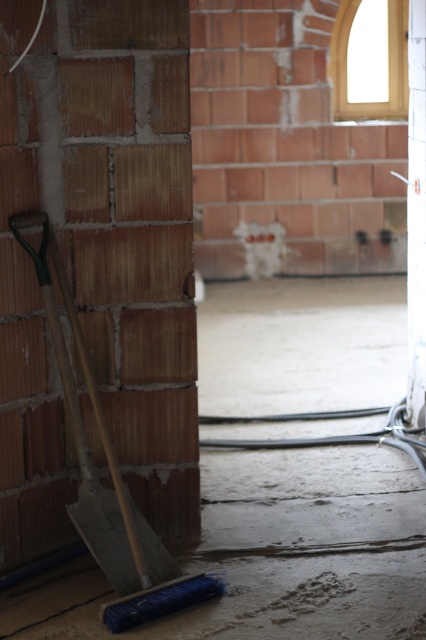
Does wooden shovel at left appear under white glossy pillar at center?

Indeed, wooden shovel at left is positioned under white glossy pillar at center.

This screenshot has height=640, width=426. Describe the element at coordinates (112, 480) in the screenshot. I see `wooden shovel at left` at that location.

Who is more distant from viewer, (104, 624) or (417, 38)?

Positioned behind is point (417, 38).

What are the coordinates of `wooden shovel at left` in the screenshot? It's located at (112, 480).

Is point (310, 358) more distant than point (138, 515)?

Yes, it is.

You are a GUI agent. You are given a task and a screenshot of the screen. Output one action in this format:
    pyautogui.click(x=<x>, y=<y>)
    Task: Click on the blue bristle broom at left
    This screenshot has height=640, width=426.
    Given the screenshot: What is the action you would take?
    pyautogui.click(x=273, y=554)

Who is more distant from viewer, (x=371, y=454) or (x=69, y=392)?

Positioned behind is point (x=371, y=454).

I want to click on blue bristle broom at left, so click(273, 554).

Can you confirm if blue bristle broom at left is taller than white glossy pillar at center?

In fact, blue bristle broom at left may be shorter than white glossy pillar at center.

Who is positioned more to the right, blue bristle broom at left or white glossy pillar at center?

white glossy pillar at center

Image resolution: width=426 pixels, height=640 pixels. Describe the element at coordinates (273, 554) in the screenshot. I see `blue bristle broom at left` at that location.

You are a GUI agent. You are given a task and a screenshot of the screen. Output one action in this format:
    pyautogui.click(x=<x>, y=<y>)
    Task: Click on the blue bristle broom at left
    
    Given the screenshot: What is the action you would take?
    pyautogui.click(x=273, y=554)